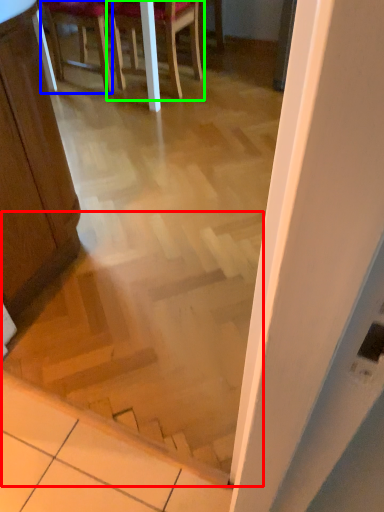
Question: Which object is positioned closest to stairwell (highlighted by a red box)? Select from chair (highlighted by a blue box) and chair (highlighted by a green box).

Choices:
 (A) chair
 (B) chair

Answer: (B)